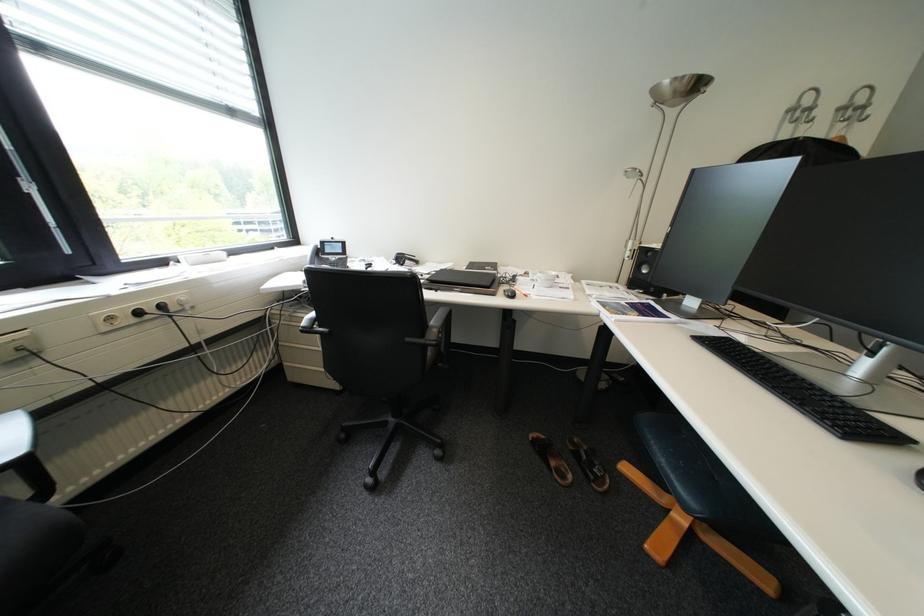
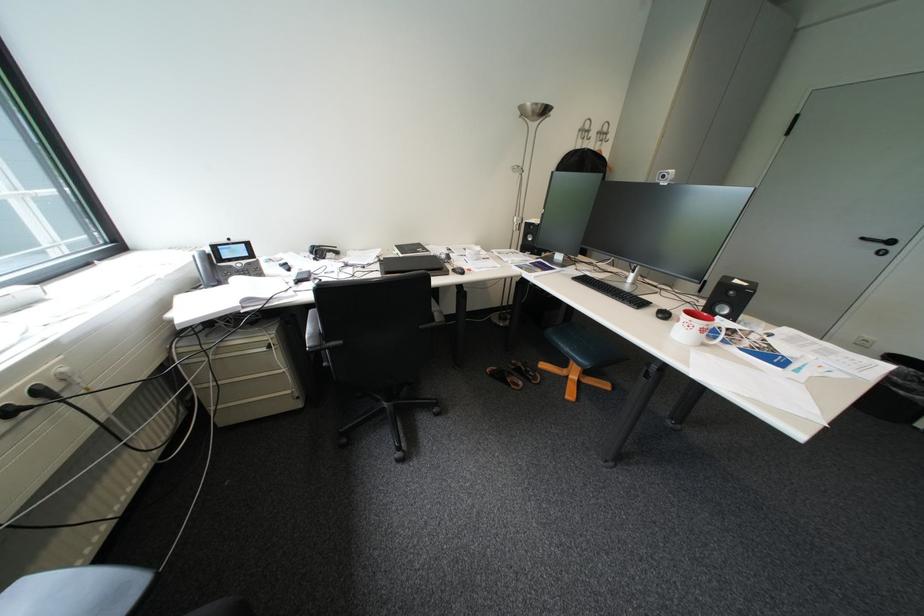
Locate, in the second image, the point that corresponds to (662,437) in the first image.

(569, 341)